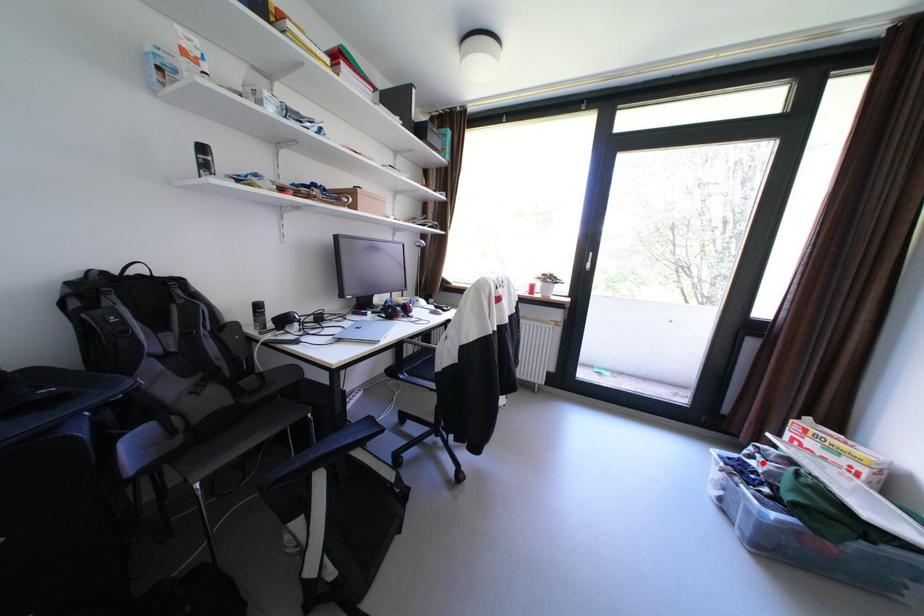
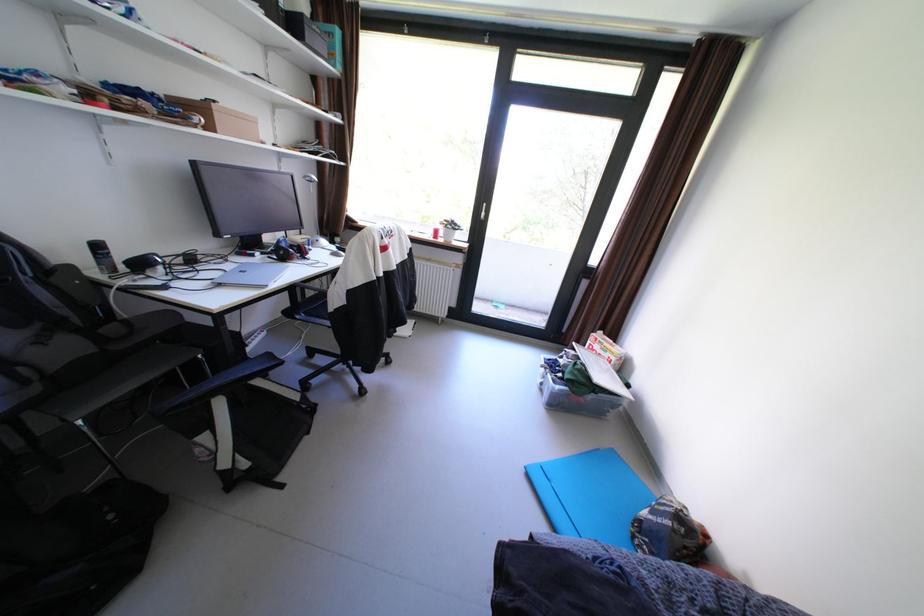
Where in the second image is the point corresponding to the highlighted location from the first image?

(572, 361)